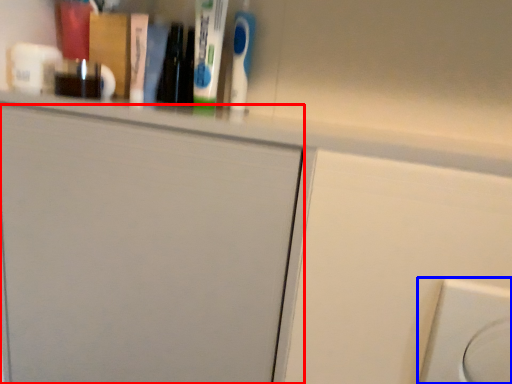
Question: Among these objects, which one is nearest to the camera, door (highlighted by a red box) or electric outlet (highlighted by a blue box)?

Choices:
 (A) door
 (B) electric outlet

Answer: (B)